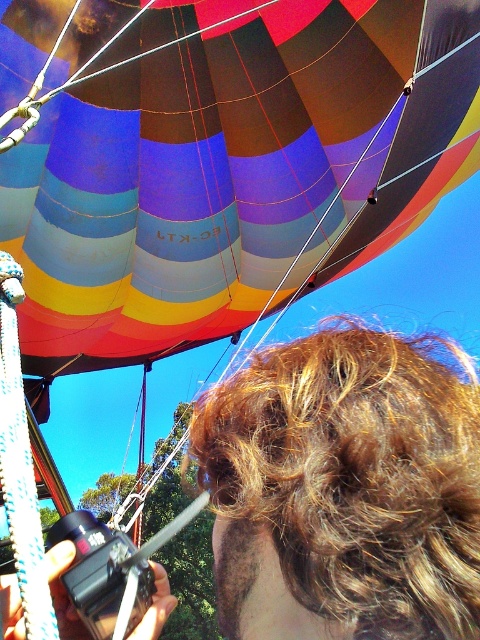
Does multicolored fabric balloon at upper center come in front of shiny brown hair at center?

No, it is not.

Does multicolored fabric balloon at upper center appear on the right side of shiny brown hair at center?

Incorrect, multicolored fabric balloon at upper center is not on the right side of shiny brown hair at center.

Is point (362, 124) less distant than point (269, 442)?

No, (362, 124) is behind (269, 442).

Where is `multicolored fabric balloon at upper center`? The height and width of the screenshot is (640, 480). multicolored fabric balloon at upper center is located at coordinates (228, 163).